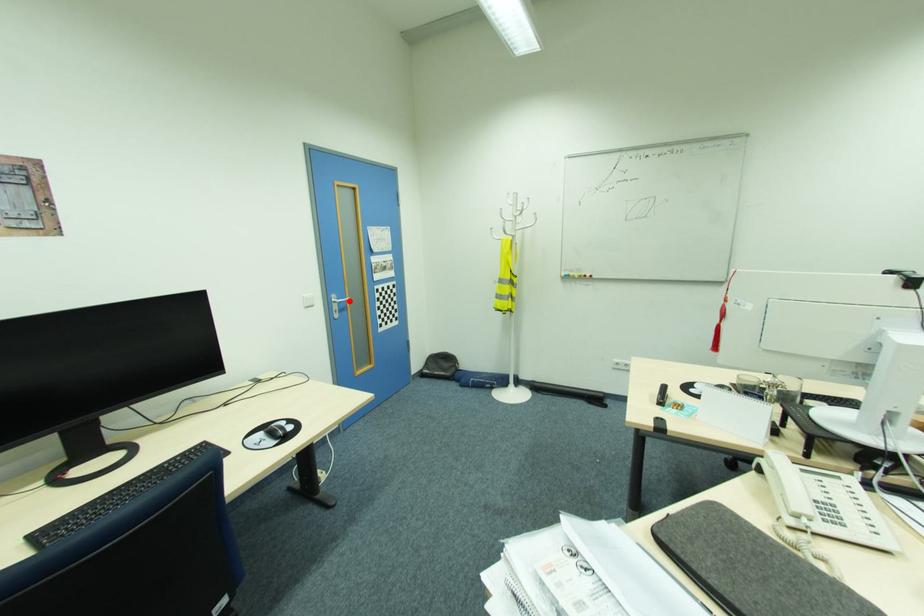
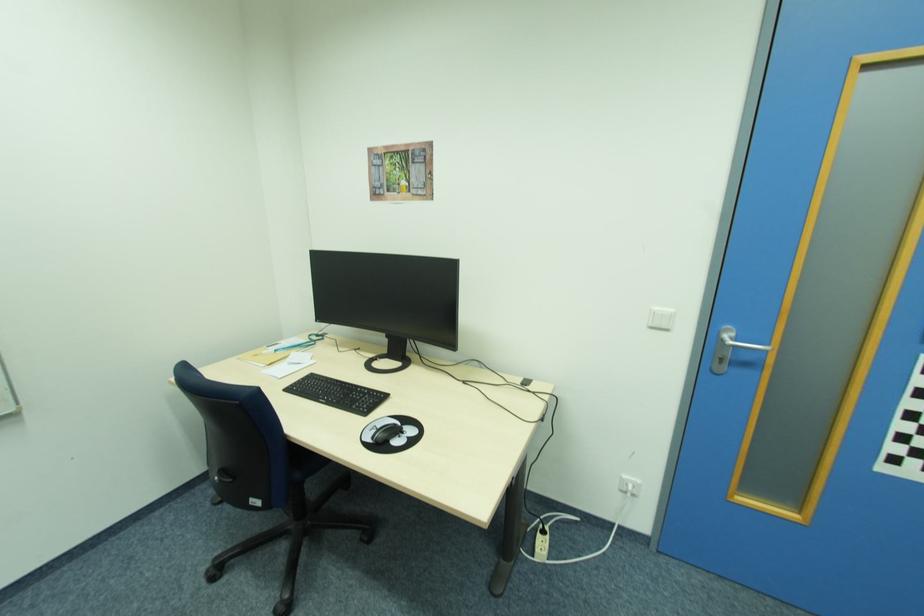
Question: I am providing you with two images of the same scene from different viewpoints. A red point is shown in image1. For the corresponding object point in image2, is it positioned nearer or farther from the camera?

Choices:
 (A) Nearer
 (B) Farther

Answer: (B)